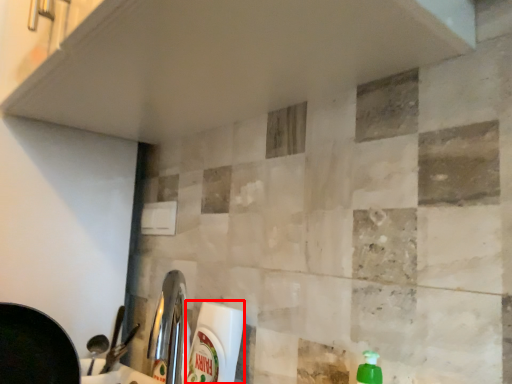
Question: From the image's perspective, where is cleaning product (annotated by the red box) located in relation to counter top in the image?

Choices:
 (A) below
 (B) above

Answer: (B)